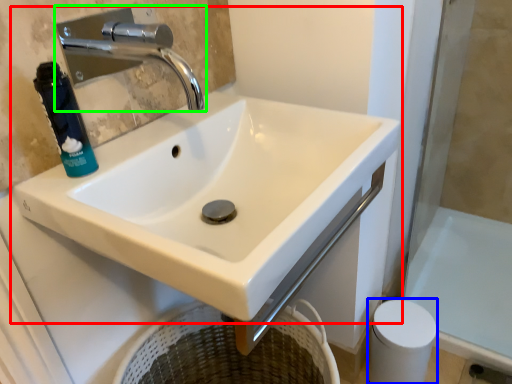
Question: Which object is positioned closest to sink (highlighted by a red box)? Select from toilet paper (highlighted by a blue box) and tap (highlighted by a green box).

Choices:
 (A) toilet paper
 (B) tap

Answer: (A)